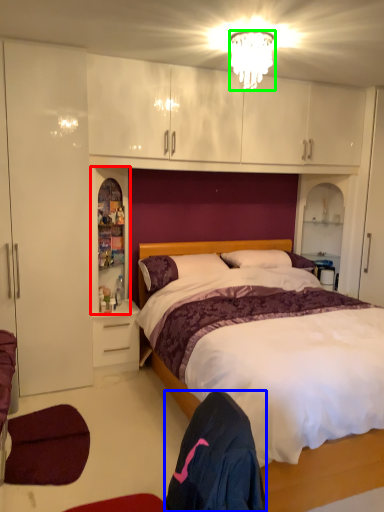
Question: Which object is the farthest from cabinet (highlighted by a red box)? Choose among these: robe (highlighted by a blue box) or lamp (highlighted by a green box).

Choices:
 (A) robe
 (B) lamp

Answer: (A)